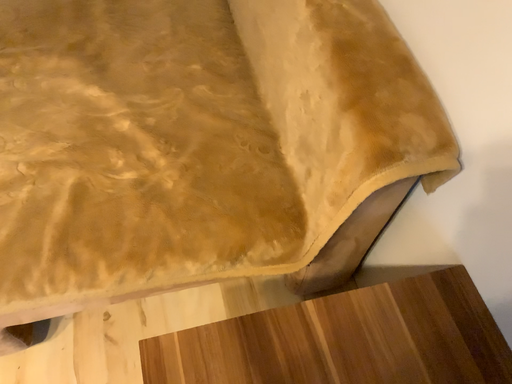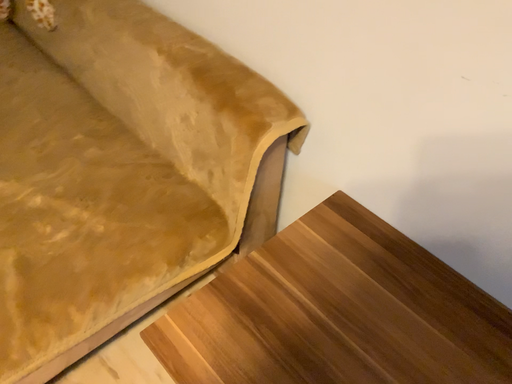
Question: Which way did the camera rotate in the video?

Choices:
 (A) rotated right
 (B) rotated left

Answer: (A)